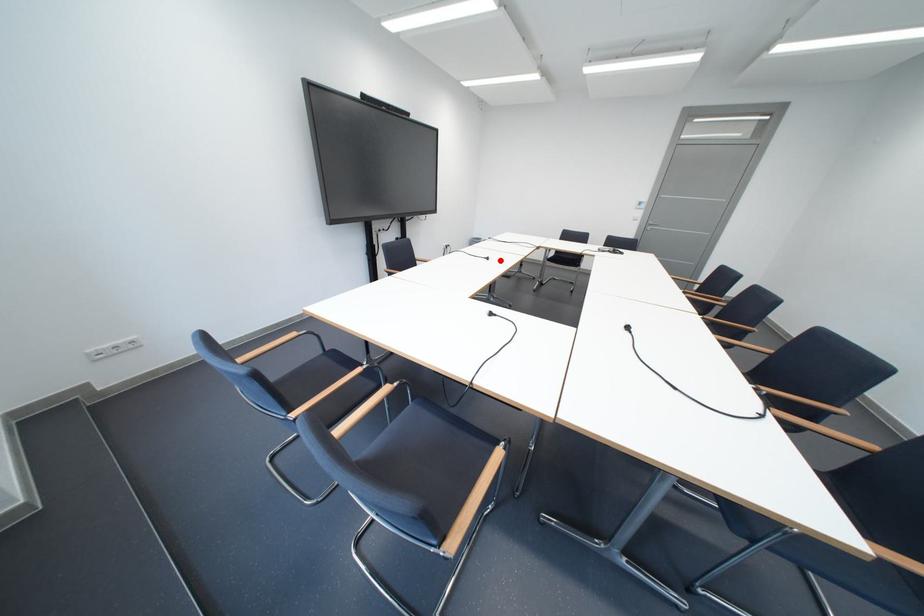
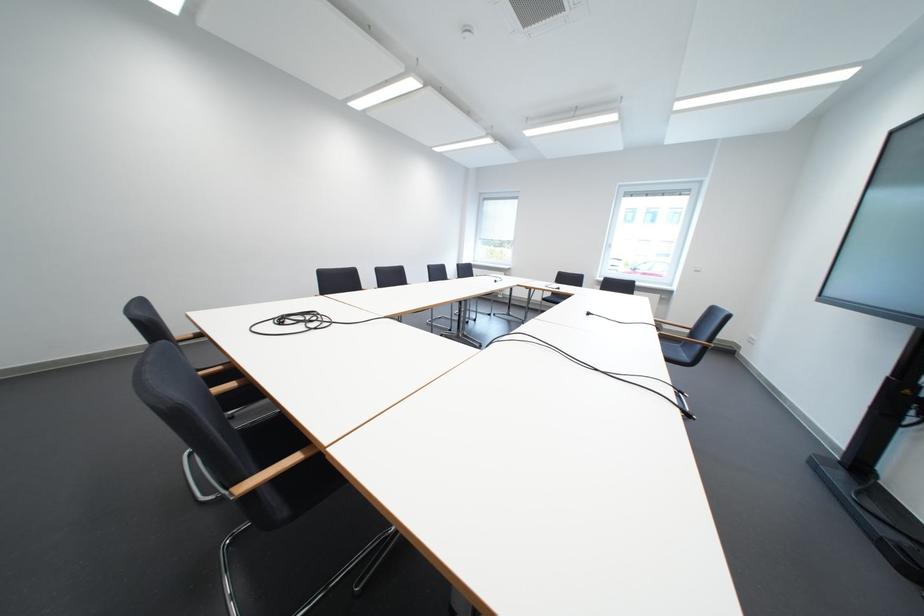
Question: A red point is marked in image1. In image2, is the corresponding 3D point closer to the camera or farther? Reply with the corresponding letter.

Choices:
 (A) The corresponding 3D point is closer.
 (B) The corresponding 3D point is farther.

Answer: (A)